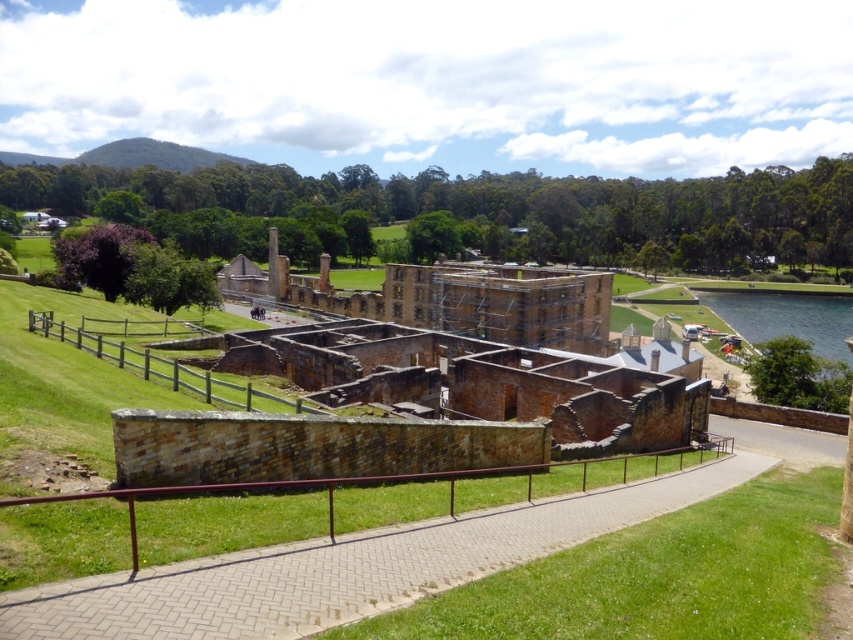
You are standing at the entrance of the historical site and see the brick paved walkway at center. According to the map, there is a point marked at coordinates (347, 566). Where is this point located in relation to the brick paved walkway at center?

The point marked at coordinates (347, 566) corresponds to the brick paved walkway at center, so it is located exactly on the walkway.